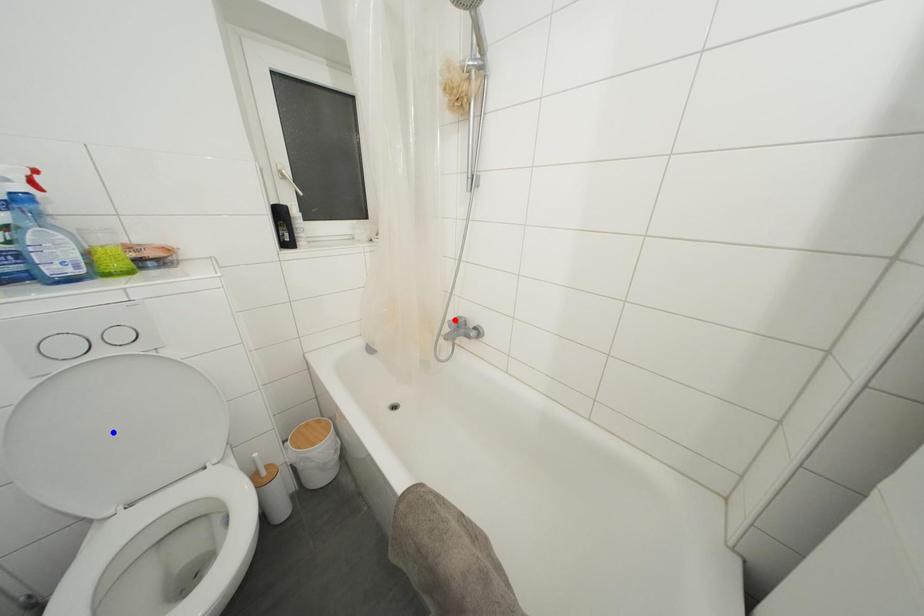
Question: Two points are marked on the image. Which point is closer to the camera?

Choices:
 (A) Blue point is closer.
 (B) Red point is closer.

Answer: (A)